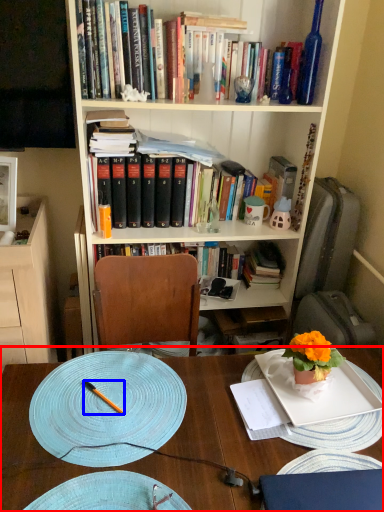
Question: Which of the following is the farthest to the observer, desk (highlighted by a red box) or pen (highlighted by a blue box)?

Choices:
 (A) desk
 (B) pen

Answer: (B)